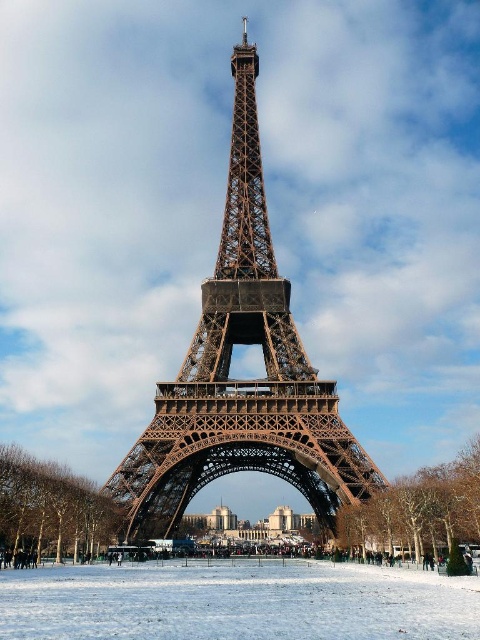
Measure the distance between point [337,500] and camera.

Point [337,500] is 363.23 feet away from camera.

Based on the photo, does brown metallic eiffel tower at center appear over white powdery snow at center?

Indeed, brown metallic eiffel tower at center is positioned over white powdery snow at center.

Locate an element on the screen. The image size is (480, 640). brown metallic eiffel tower at center is located at coordinates (241, 380).

Identify the location of brown metallic eiffel tower at center. (x=241, y=380).